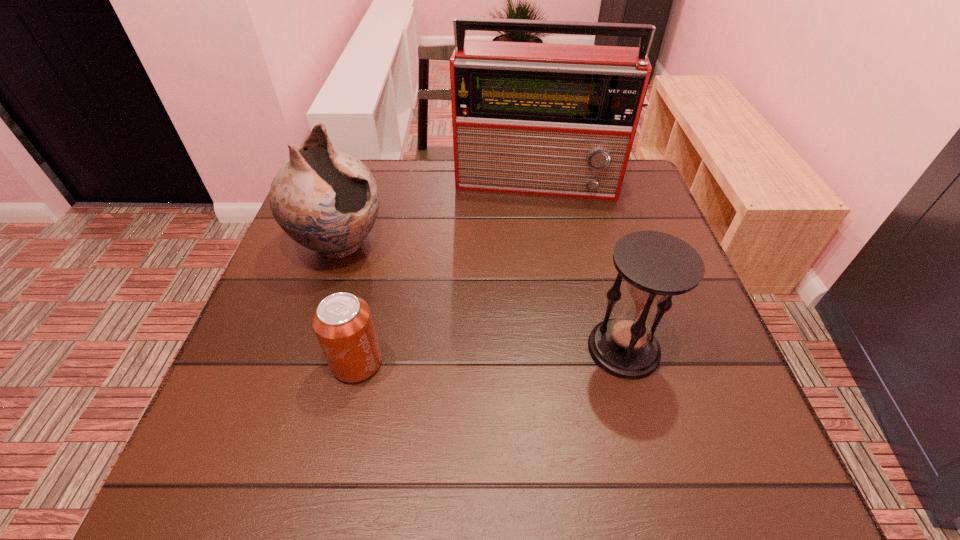
I want to click on object that is the second closest one to the can, so click(x=656, y=266).

Locate an element on the screen. The image size is (960, 540). object that is the third closest one to the second shortest object is located at coordinates (327, 200).